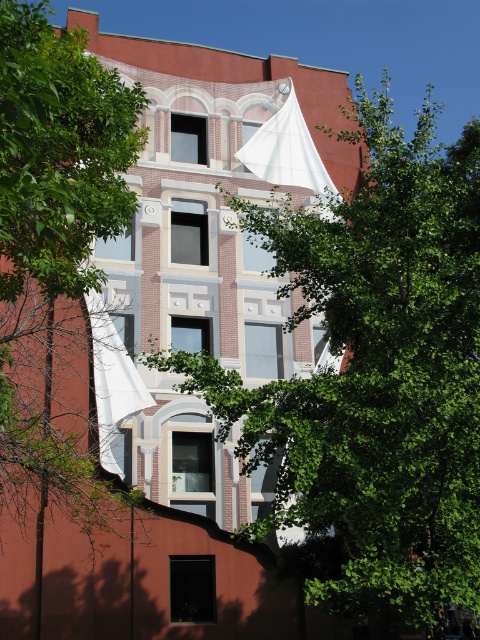
Who is shorter, green leafy tree at upper center or green leafy tree at left?

green leafy tree at left

From the picture: Does green leafy tree at upper center have a greater height compared to green leafy tree at left?

Indeed, green leafy tree at upper center has a greater height compared to green leafy tree at left.

Image resolution: width=480 pixels, height=640 pixels. Describe the element at coordinates (372, 380) in the screenshot. I see `green leafy tree at upper center` at that location.

You are a GUI agent. You are given a task and a screenshot of the screen. Output one action in this format:
    pyautogui.click(x=<x>, y=<y>)
    Task: Click on the green leafy tree at upper center
    This screenshot has height=640, width=480.
    Given the screenshot: What is the action you would take?
    pyautogui.click(x=372, y=380)

Does green leafy tree at left lie behind white fabric canopy at upper center?

No, it is not.

Which is in front, point (120, 145) or point (331, 179)?

Positioned in front is point (120, 145).

You are a GUI agent. You are given a task and a screenshot of the screen. Output one action in this format:
    pyautogui.click(x=<x>, y=<y>)
    Task: Click on the green leafy tree at left
    Image resolution: width=480 pixels, height=640 pixels.
    Given the screenshot: What is the action you would take?
    pyautogui.click(x=60, y=154)

Where is `green leafy tree at left`? This screenshot has width=480, height=640. green leafy tree at left is located at coordinates (60, 154).

In the scene shown: Between green leafy tree at upper center and white fabric canopy at upper center, which one appears on the left side from the viewer's perspective?

Positioned to the left is white fabric canopy at upper center.

Is point (418, 573) farther from viewer compared to point (286, 161)?

No, (418, 573) is in front of (286, 161).

Is point (294, 401) farther from camera compared to point (264, 157)?

No, it is not.

The height and width of the screenshot is (640, 480). Find the location of `green leafy tree at upper center`. green leafy tree at upper center is located at coordinates (372, 380).